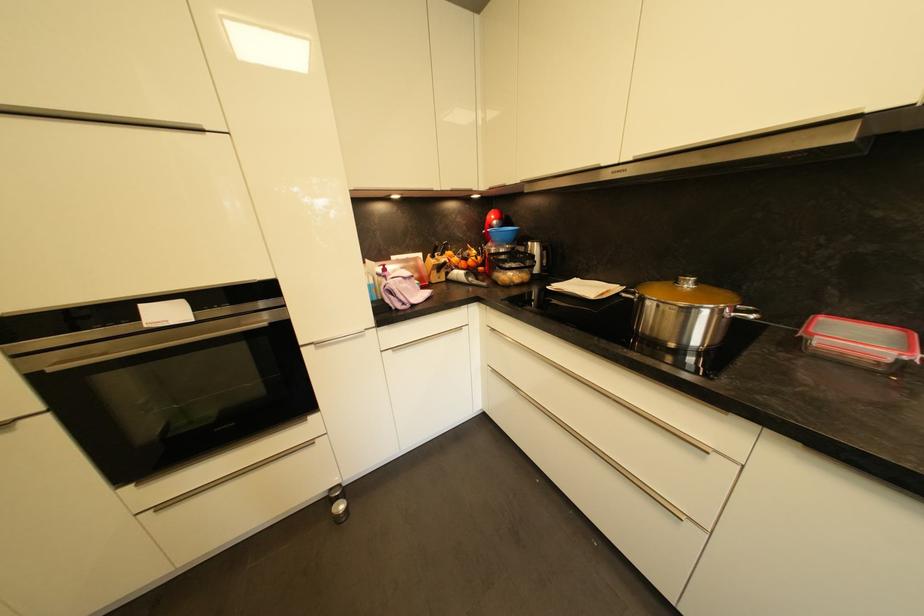
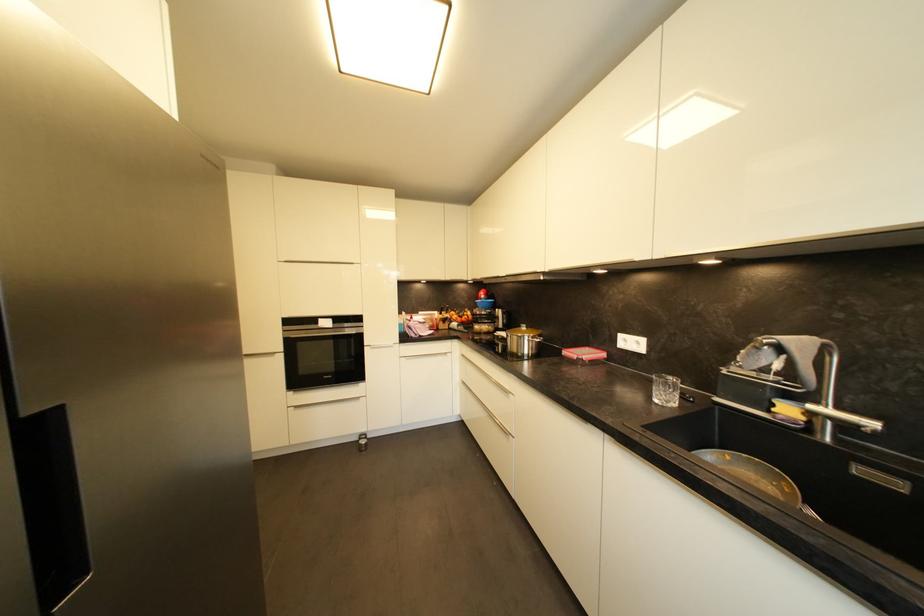
The point at (758, 318) is marked in the first image. Where is the corresponding point in the second image?

(541, 342)